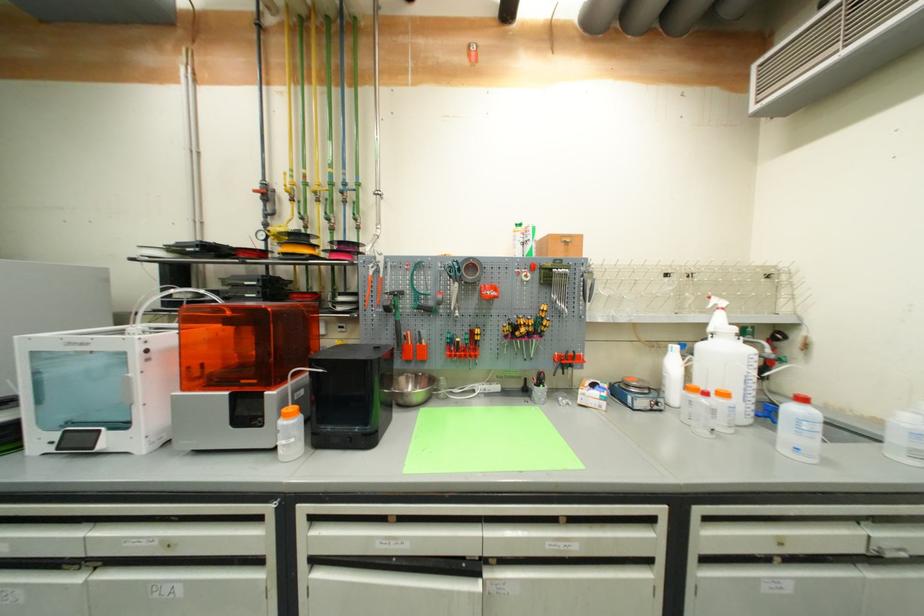
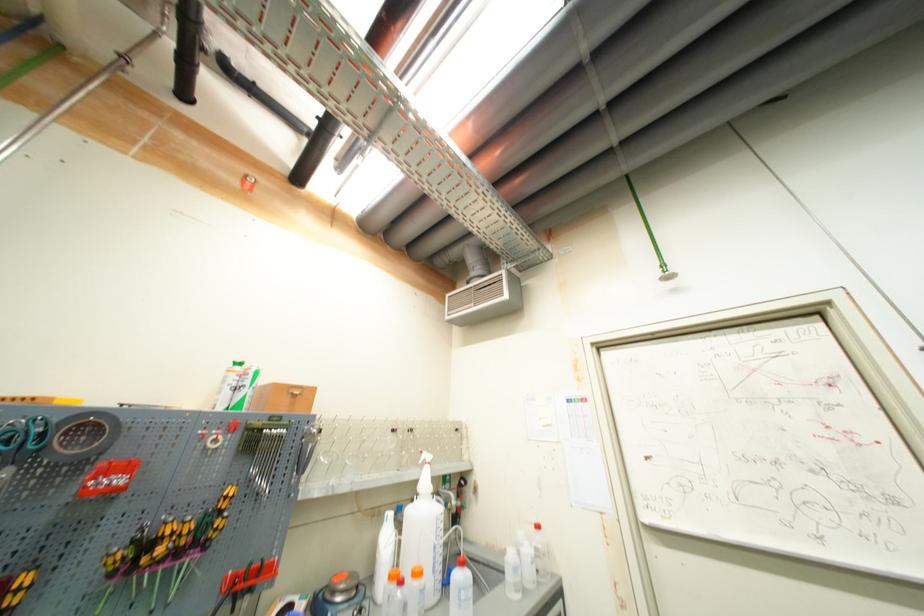
Locate, in the second image, the point that corresponds to (479,55) in the first image.

(253, 185)